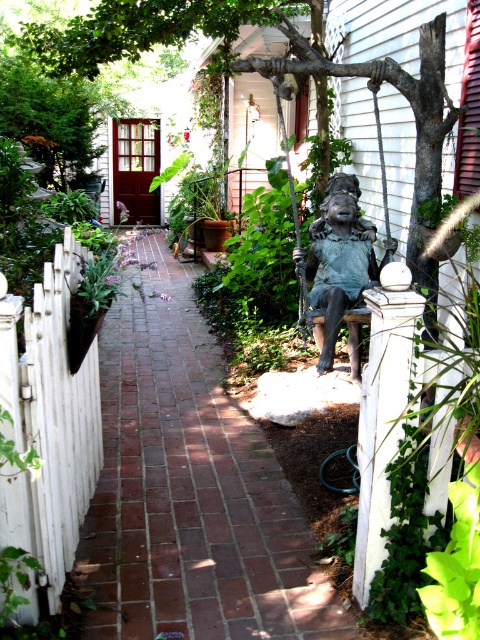
Question: Which of the following is the farthest from the observer?

Choices:
 (A) bronze statue at center
 (B) brick at center

Answer: (A)

Question: Is brick at center to the right of bronze statue at center from the viewer's perspective?

Choices:
 (A) no
 (B) yes

Answer: (A)

Question: Estimate the real-world distances between objects in this image. Which object is closer to the white picket fence at left?

Choices:
 (A) bronze statue at center
 (B) brick at center

Answer: (B)

Question: Is white picket fence at left bigger than bronze statue at center?

Choices:
 (A) yes
 (B) no

Answer: (B)

Question: Among these objects, which one is nearest to the camera?

Choices:
 (A) bronze statue at center
 (B) white picket fence at left

Answer: (B)

Question: Can you confirm if white picket fence at left is positioned to the right of bronze statue at center?

Choices:
 (A) no
 (B) yes

Answer: (A)